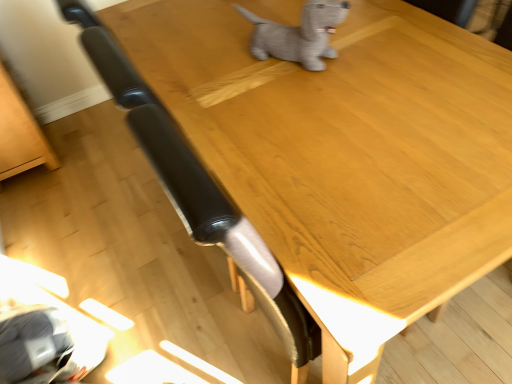
Find the location of a particular element. vacant space underneath gray plush dog at upper center (from a real-world perspective) is located at coordinates (293, 66).